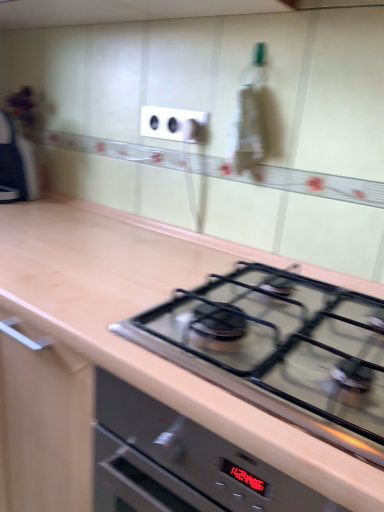
Question: Is white plastic electrical outlet at upper center not close to matte black knob at upper center?

Choices:
 (A) yes
 (B) no

Answer: (B)

Question: Can you confirm if white plastic electrical outlet at upper center is wider than matte black knob at upper center?

Choices:
 (A) yes
 (B) no

Answer: (B)

Question: Is the position of white plastic electrical outlet at upper center less distant than that of matte black knob at upper center?

Choices:
 (A) yes
 (B) no

Answer: (A)

Question: Is white plastic electrical outlet at upper center at the left side of matte black knob at upper center?

Choices:
 (A) yes
 (B) no

Answer: (A)

Question: Is white plastic electrical outlet at upper center aimed at matte black knob at upper center?

Choices:
 (A) no
 (B) yes

Answer: (B)

Question: Considering the relative sizes of white plastic electrical outlet at upper center and matte black knob at upper center in the image provided, is white plastic electrical outlet at upper center shorter than matte black knob at upper center?

Choices:
 (A) yes
 (B) no

Answer: (B)

Question: From the image's perspective, is satin black gas stove at center below matte black knob at upper center?

Choices:
 (A) yes
 (B) no

Answer: (A)

Question: From the image's perspective, is satin black gas stove at center above matte black knob at upper center?

Choices:
 (A) no
 (B) yes

Answer: (A)

Question: From a real-world perspective, is satin black gas stove at center under matte black knob at upper center?

Choices:
 (A) yes
 (B) no

Answer: (A)

Question: Is satin black gas stove at center not within matte black knob at upper center?

Choices:
 (A) yes
 (B) no

Answer: (A)

Question: Can you see satin black gas stove at center touching matte black knob at upper center?

Choices:
 (A) yes
 (B) no

Answer: (B)

Question: Is satin black gas stove at center not close to matte black knob at upper center?

Choices:
 (A) yes
 (B) no

Answer: (B)

Question: Considering the relative positions of satin black gas stove at center and white plastic electrical outlet at upper center in the image provided, is satin black gas stove at center in front of white plastic electrical outlet at upper center?

Choices:
 (A) yes
 (B) no

Answer: (A)